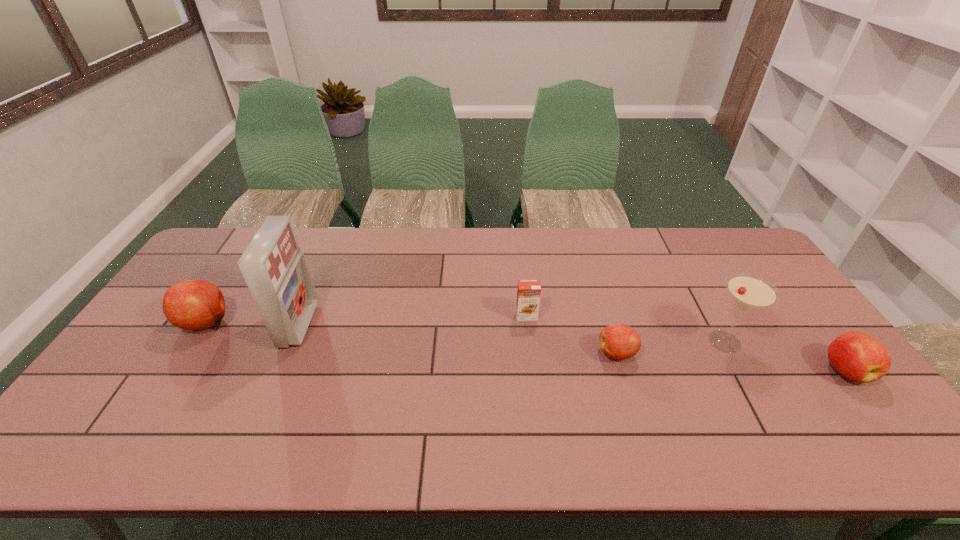
Identify the location of object positioned at the near right corner. The width and height of the screenshot is (960, 540). (859, 357).

Locate an element on the screen. vacant space at the far edge is located at coordinates (411, 259).

This screenshot has height=540, width=960. I want to click on blank space at the near edge, so click(178, 391).

In order to click on vacant space at the left edge of the desktop in this screenshot , I will do `click(182, 362)`.

In the image, there is a desktop. Where is `free space at the right edge`? free space at the right edge is located at coordinates (802, 315).

At what (x,y) coordinates should I click in order to perform the action: click on free area in between the tallest object and the martini. Please return your answer as a coordinate pair (x, y). The width and height of the screenshot is (960, 540). Looking at the image, I should click on (512, 333).

Where is `free point between the second apple from right to left and the orange juice`? free point between the second apple from right to left and the orange juice is located at coordinates [x=571, y=334].

Image resolution: width=960 pixels, height=540 pixels. I want to click on free space between the third object from left to right and the rightmost object, so click(685, 343).

Find the location of `vacant space in between the martini and the leftmost object`. vacant space in between the martini and the leftmost object is located at coordinates (466, 332).

Locate an element on the screen. The height and width of the screenshot is (540, 960). unoccupied position between the martini and the leftmost object is located at coordinates (466, 332).